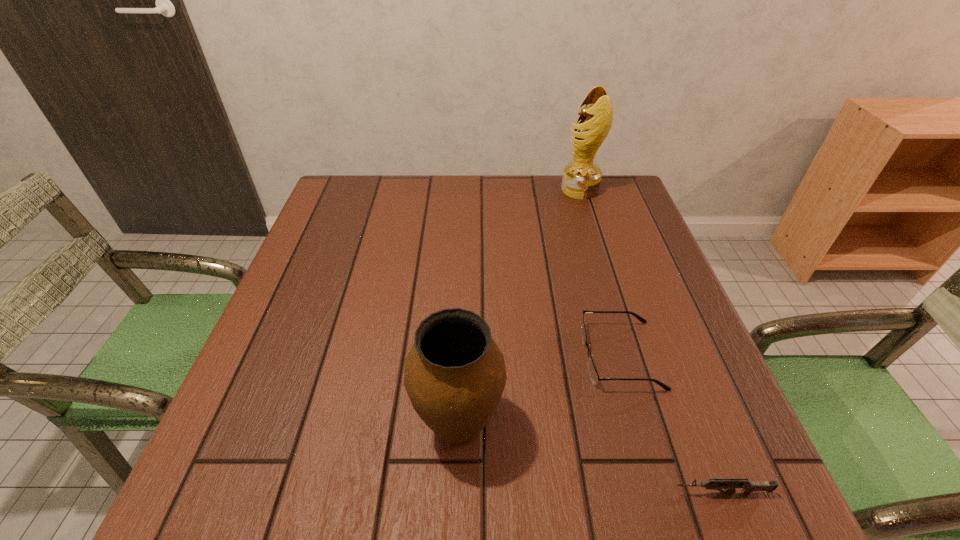
I want to click on free space at the near right corner of the desktop, so click(759, 503).

Find the location of a particular element. The image size is (960, 540). free point between the third shortest object and the gun is located at coordinates (589, 460).

At what (x,y) coordinates should I click in order to perform the action: click on empty space that is in between the spectacles and the tallest object. Please return your answer as a coordinate pair (x, y). Image resolution: width=960 pixels, height=540 pixels. Looking at the image, I should click on (600, 272).

At what (x,y) coordinates should I click in order to perform the action: click on vacant space that's between the spectacles and the tallest object. Please return your answer as a coordinate pair (x, y). Looking at the image, I should click on point(600,272).

Identify the location of free point between the second tallest object and the spectacles. (540, 391).

At what (x,y) coordinates should I click in order to perform the action: click on blank region between the nearest object and the award. Please return your answer as a coordinate pair (x, y). This screenshot has height=540, width=960. Looking at the image, I should click on (650, 341).

Find the location of a particular element. The width and height of the screenshot is (960, 540). vacant area that lies between the farthest object and the gun is located at coordinates (650, 341).

You are a GUI agent. You are given a task and a screenshot of the screen. Output one action in this format:
    pyautogui.click(x=<x>, y=<y>)
    Task: Click on the empty space between the gun and the farthest object
    
    Given the screenshot: What is the action you would take?
    pyautogui.click(x=650, y=341)

This screenshot has width=960, height=540. In order to click on vacant area between the tallest object and the spectacles in this screenshot , I will do `click(600, 272)`.

Locate an element on the screen. free space that is in between the farthest object and the spectacles is located at coordinates (600, 272).